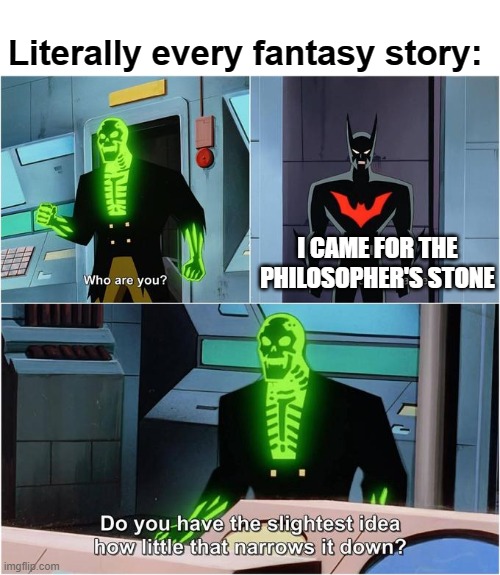
The width and height of the screenshot is (500, 575). What are the coordinates of `pink surface` in the screenshot? It's located at (11, 548).